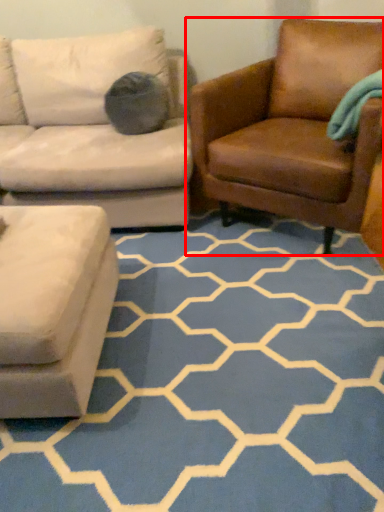
Question: Observing the image, what is the correct spatial positioning of chair (annotated by the red box) in reference to pattern?

Choices:
 (A) left
 (B) right

Answer: (B)